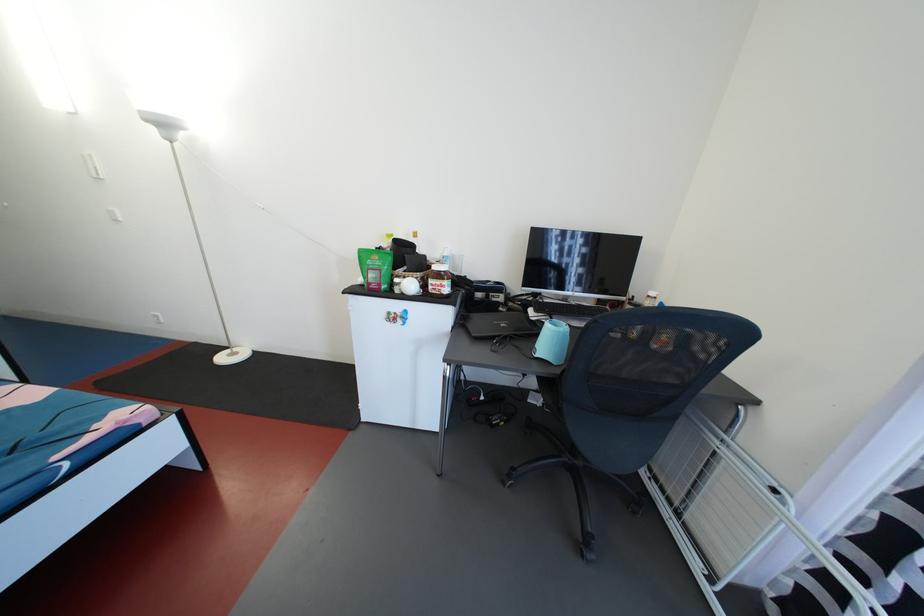
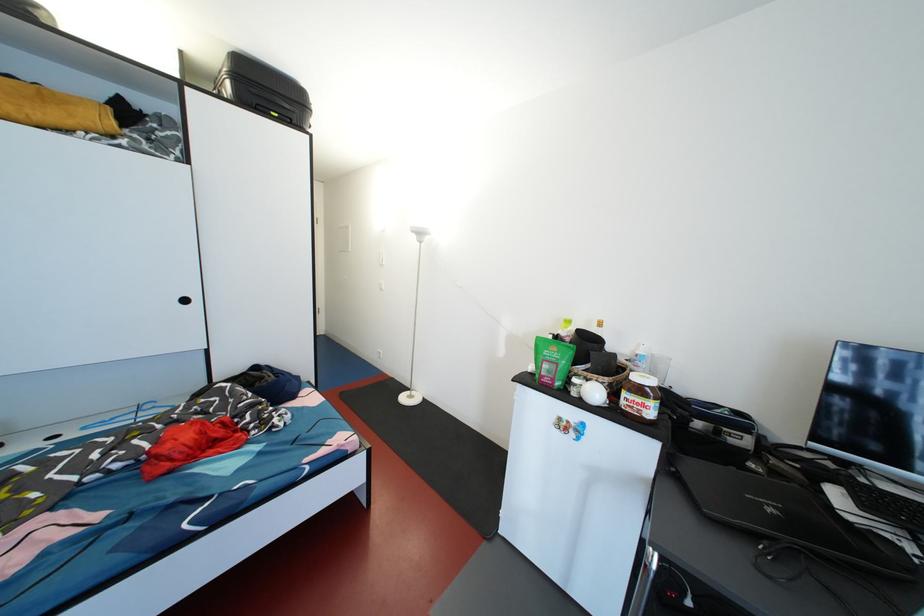
Question: Based on the continuous images, in which direction is the camera rotating? Reply with the corresponding letter.

Choices:
 (A) Left
 (B) Right
 (C) Up
 (D) Down

Answer: (A)